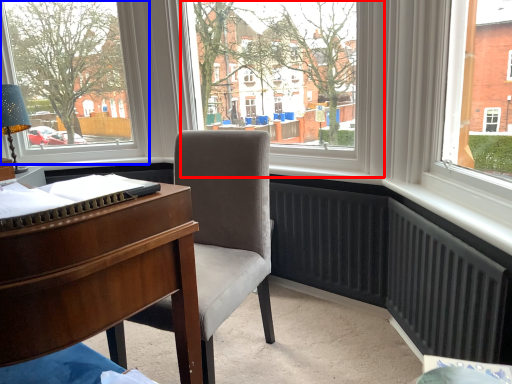
Question: Which object appears farthest to the camera in this image, window screen (highlighted by a red box) or window (highlighted by a blue box)?

Choices:
 (A) window screen
 (B) window

Answer: (B)